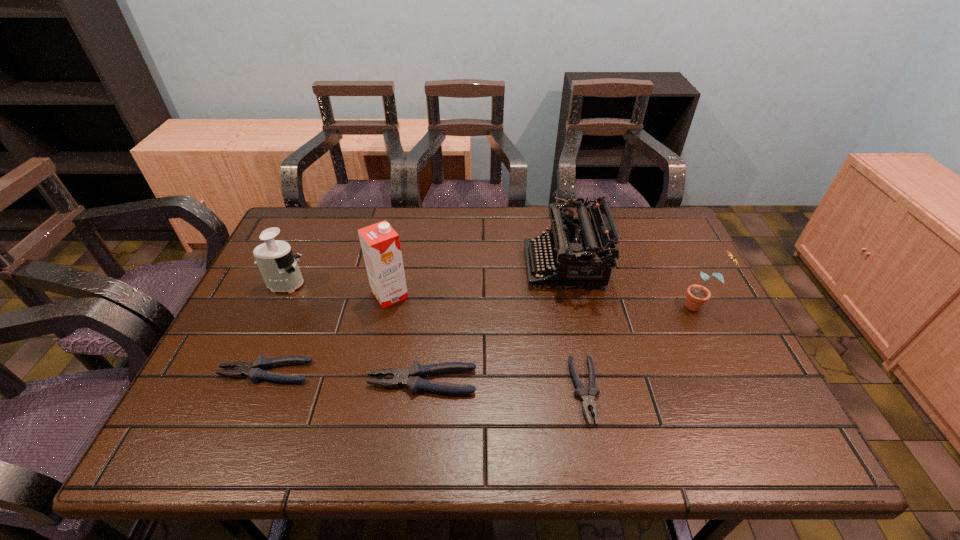
At what (x,y) coordinates should I click in order to perform the action: click on object located at the far edge. Please return your answer as a coordinate pair (x, y). The height and width of the screenshot is (540, 960). Looking at the image, I should click on (582, 251).

Where is `pliers that is at the left edge`? pliers that is at the left edge is located at coordinates (255, 370).

I want to click on juicer that is at the left edge, so click(x=279, y=269).

Find the location of `object at the right edge`. object at the right edge is located at coordinates (697, 295).

This screenshot has width=960, height=540. What are the coordinates of `object located at the near left corner` in the screenshot? It's located at 255,370.

At what (x,y) coordinates should I click in order to perform the action: click on free region at the far edge. Please return your answer as a coordinate pair (x, y). The width and height of the screenshot is (960, 540). Looking at the image, I should click on (470, 219).

Locate an element on the screen. The image size is (960, 540). vacant space at the near edge of the desktop is located at coordinates (656, 380).

Image resolution: width=960 pixels, height=540 pixels. I want to click on free space at the right edge of the desktop, so click(693, 275).

What are the coordinates of `vacant space at the far left corner of the desktop` in the screenshot? It's located at (302, 224).

Locate an element on the screen. This screenshot has width=960, height=540. free space at the far right corner of the desktop is located at coordinates (648, 213).